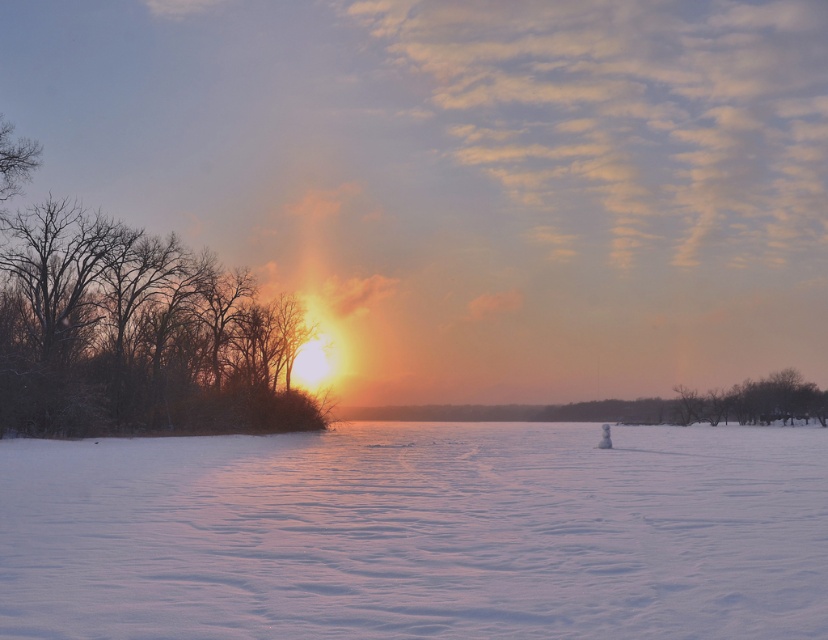
You are an artist planning to paint this winter scene. You want to ensure the snow at the center takes up more visual space than the tree on the right in your painting. Based on the image, does the white matte snow at center naturally occupy a larger area compared to the smooth brown tree at right?

Yes, the white matte snow at center naturally occupies a larger area than the smooth brown tree at right because its width is greater according to the description.